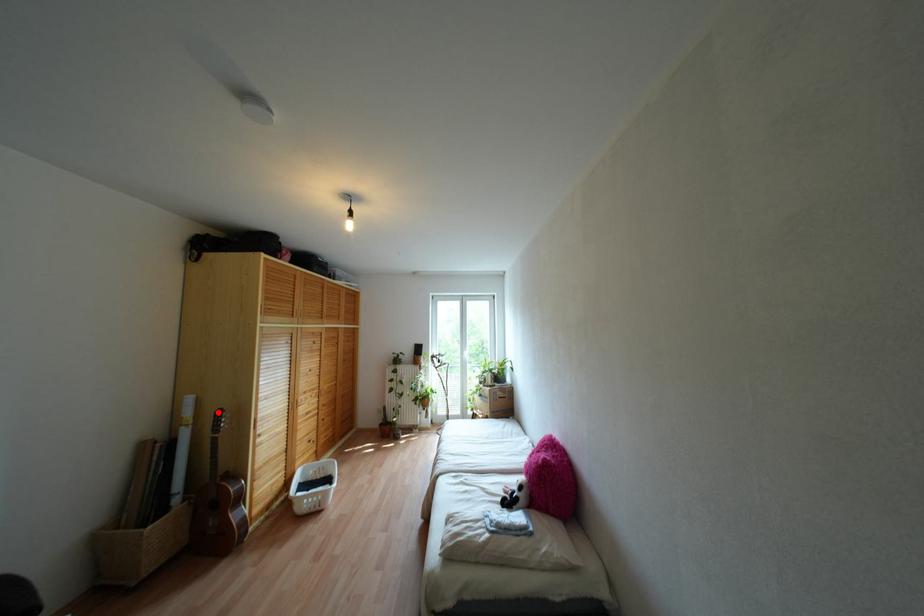
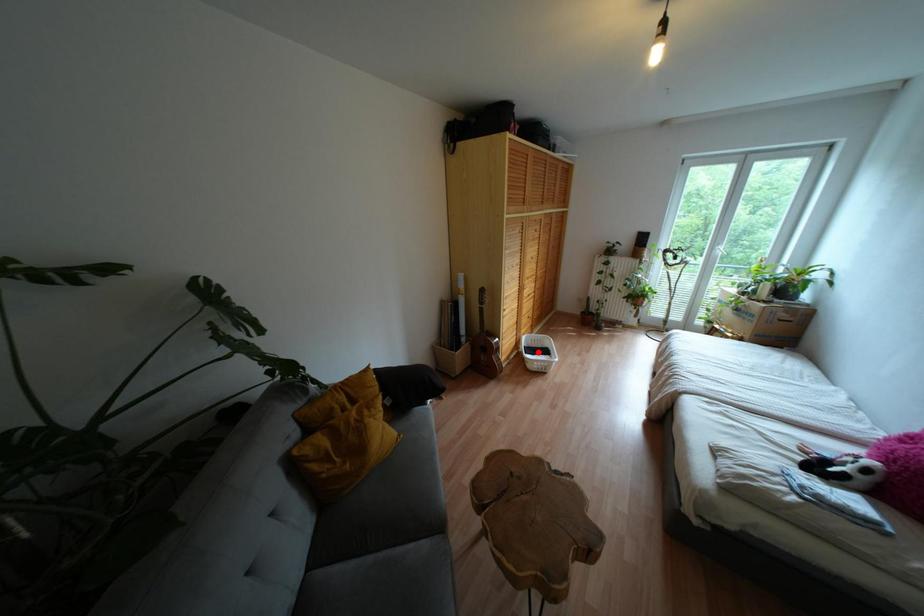
I am providing you with two images of the same scene from different viewpoints. A red point is marked on the first image and another point is marked on the second image. Does the point marked in image1 correspond to the same location as the one in image2?

No